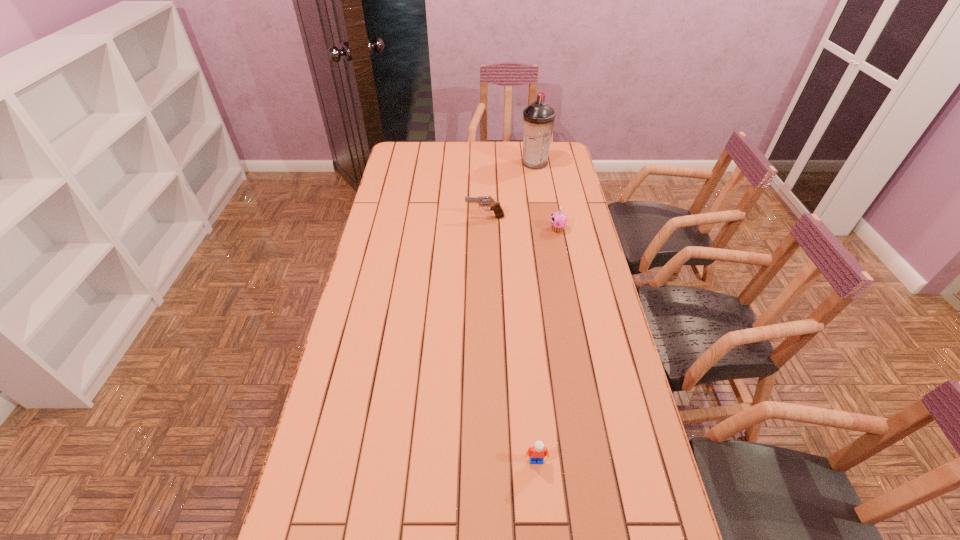
Find the location of `the farthest object`. the farthest object is located at coordinates (538, 118).

The image size is (960, 540). I want to click on the tallest object, so click(538, 118).

Locate an element on the screen. The image size is (960, 540). the second nearest object is located at coordinates (558, 220).

This screenshot has height=540, width=960. I want to click on the leftmost object, so click(x=495, y=206).

Where is `pistol`? This screenshot has height=540, width=960. pistol is located at coordinates (495, 206).

Find the location of `the second object from left to right`. the second object from left to right is located at coordinates (538, 451).

I want to click on Lego, so click(x=538, y=451).

At what (x,y) coordinates should I click in order to perform the action: click on vacant area situated on the front of the farthest object. Please return your answer as a coordinate pair (x, y). This screenshot has height=540, width=960. Looking at the image, I should click on (541, 206).

The image size is (960, 540). What are the coordinates of `vacant area located 0.360m on the face of the third farthest object` in the screenshot? It's located at (457, 229).

You are a GUI agent. You are given a task and a screenshot of the screen. Output one action in this format:
    pyautogui.click(x=<x>, y=<y>)
    Task: Click on the vacant point located 0.260m on the face of the third farthest object
    The height and width of the screenshot is (540, 960).
    Given the screenshot: What is the action you would take?
    pyautogui.click(x=483, y=229)